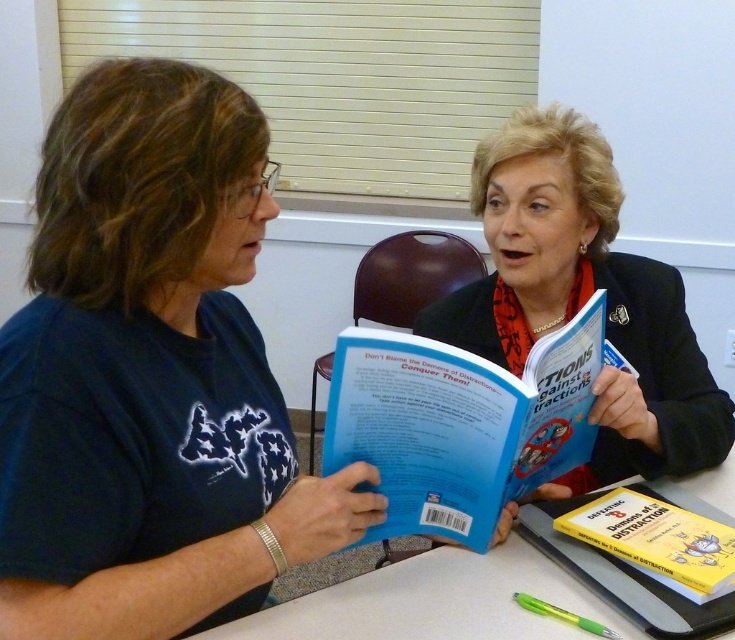
Question: Which point appears closest to the camera in this image?

Choices:
 (A) (465, 625)
 (B) (459, 513)
 (C) (620, 508)
 (D) (143, 353)

Answer: (D)

Question: Is matte black jacket at center bigger than white plastic table at center?

Choices:
 (A) no
 (B) yes

Answer: (B)

Question: Which point appears farthest from the camera in this image?

Choices:
 (A) (617, 513)
 (B) (218, 550)

Answer: (A)

Question: Does blue fabric shirt at left have a lesser width compared to white plastic table at center?

Choices:
 (A) no
 (B) yes

Answer: (B)

Question: Can you confirm if blue fabric shirt at left is positioned above yellow paperback book at lower right?

Choices:
 (A) yes
 (B) no

Answer: (A)

Question: Which object is farther from the camera taking this photo?

Choices:
 (A) white plastic table at center
 (B) blue paperback book at center
 (C) blue fabric shirt at left

Answer: (A)